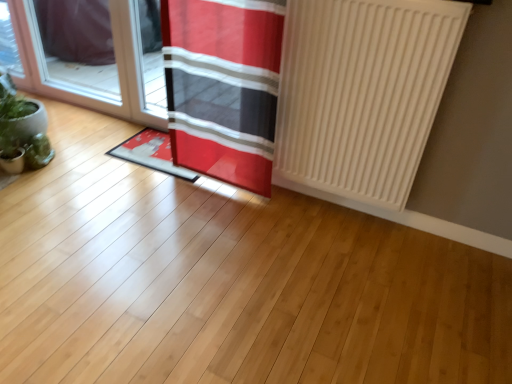
The height and width of the screenshot is (384, 512). I want to click on empty space that is ontop of red fabric doormat at center (from a real-world perspective), so click(x=147, y=145).